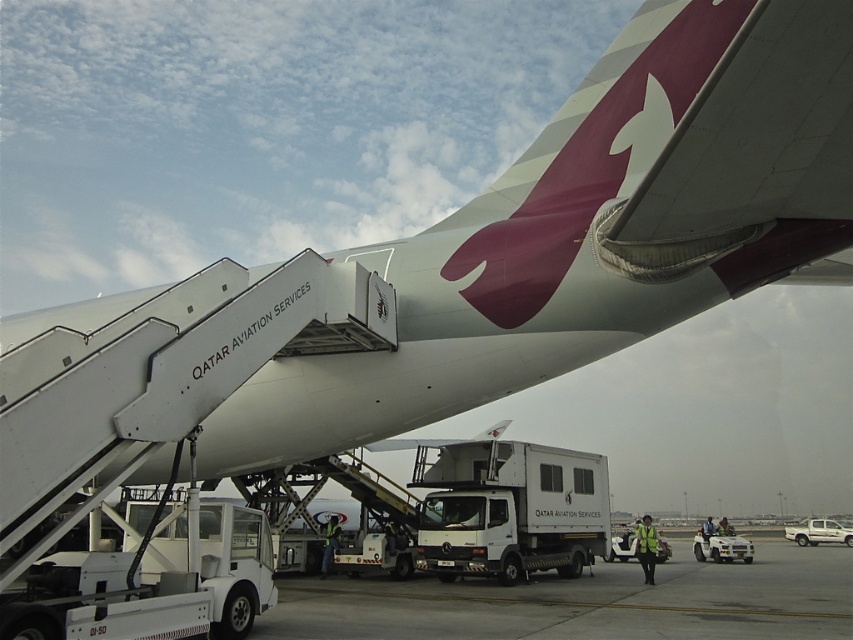
Question: Is white matte truck at lower left thinner than white matte truck at lower right?

Choices:
 (A) yes
 (B) no

Answer: (B)

Question: Among these objects, which one is nearest to the camera?

Choices:
 (A) white matte truck at lower left
 (B) white matte truck at lower right

Answer: (A)

Question: Can you confirm if white matte truck at center is positioned below white matte truck at lower right?

Choices:
 (A) no
 (B) yes

Answer: (A)

Question: From the image, what is the correct spatial relationship of white matte truck at center in relation to white matte truck at lower right?

Choices:
 (A) right
 (B) left

Answer: (B)

Question: Which point appears closest to the camera in this image?

Choices:
 (A) (846, 541)
 (B) (535, 480)
 (C) (51, 624)

Answer: (C)

Question: Which object is closer to the camera taking this photo?

Choices:
 (A) white matte truck at center
 (B) white matte truck at lower left
 (C) white matte truck at lower right

Answer: (B)